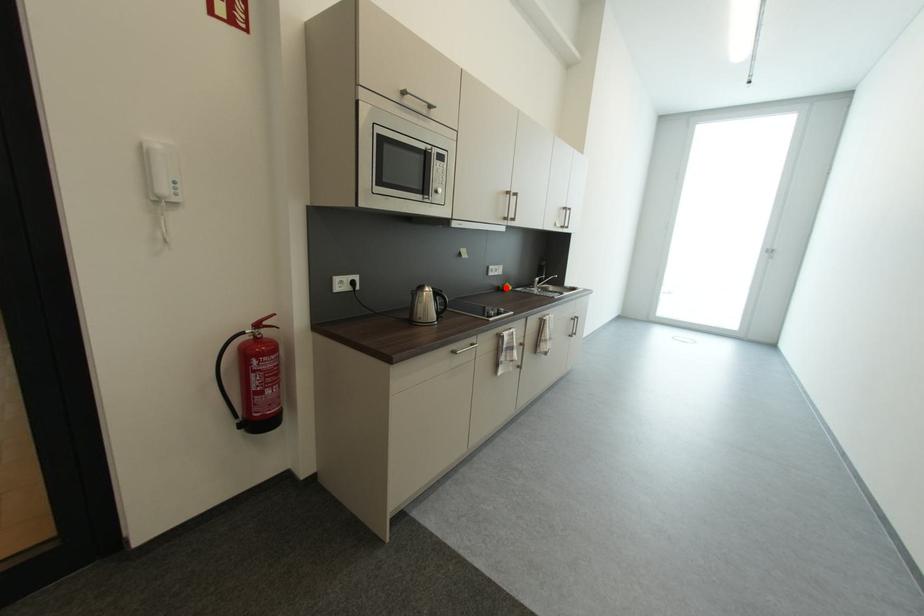
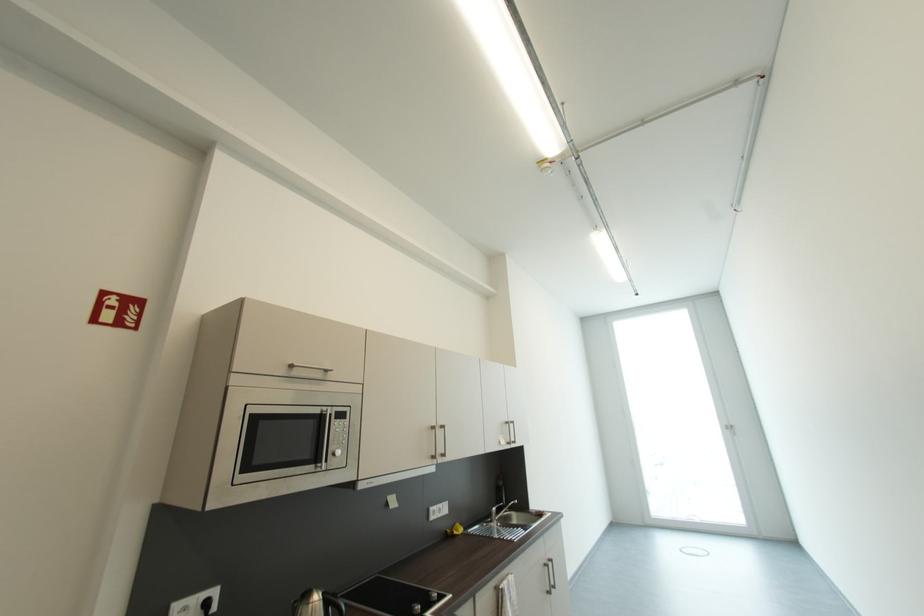
Question: I am providing you with two images of the same scene from different viewpoints. A red point is marked on the first image. Can you still see the location of the red point in image 2?

Choices:
 (A) Yes
 (B) No

Answer: (A)